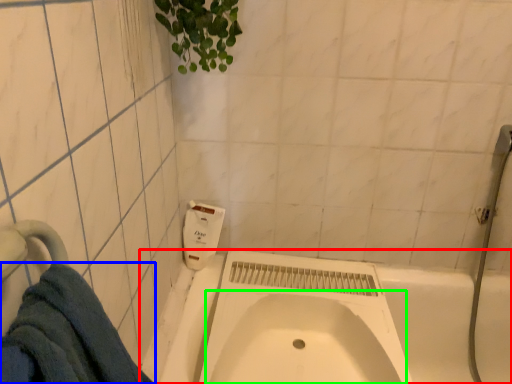
Question: Which object is positioned closest to bath (highlighted by a red box)? Select from towel (highlighted by a blue box) and sink (highlighted by a green box).

Choices:
 (A) towel
 (B) sink

Answer: (B)